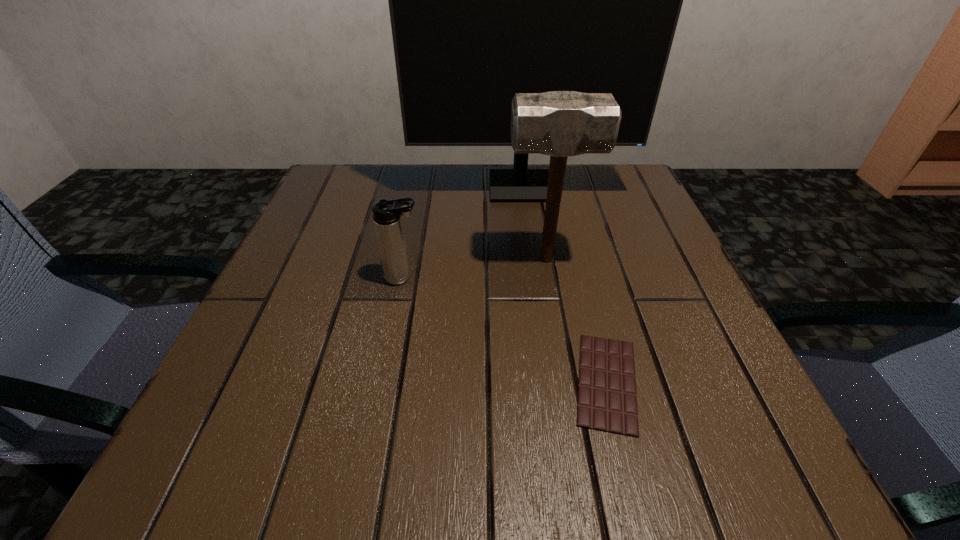
You are a GUI agent. You are given a task and a screenshot of the screen. Output one action in this format:
    pyautogui.click(x=<x>, y=<y>)
    Task: Click on the free space in the image that satisfies the following two spatial constraints: 1. on the front-facing side of the farthest object; 2. on the handle side of the thermos bottle
    This screenshot has height=540, width=960.
    Given the screenshot: What is the action you would take?
    pyautogui.click(x=532, y=278)

Where is `vacant region that satisfies the following two spatial constraints: 1. on the front-facing side of the shortest object; 2. on the left side of the tallest object`? vacant region that satisfies the following two spatial constraints: 1. on the front-facing side of the shortest object; 2. on the left side of the tallest object is located at coordinates (545, 382).

This screenshot has width=960, height=540. Identify the location of vacant point that satisfies the following two spatial constraints: 1. on the front-facing side of the tallest object; 2. on the handle side of the second shortest object. [532, 278].

In order to click on vacant space that satisfies the following two spatial constraints: 1. on the handle side of the nearest object; 2. on the left side of the thermos bottle in this screenshot , I will do `click(383, 382)`.

The image size is (960, 540). Identify the location of free space in the image that satisfies the following two spatial constraints: 1. on the striking face of the third shortest object; 2. on the back side of the chocolate bar. (567, 382).